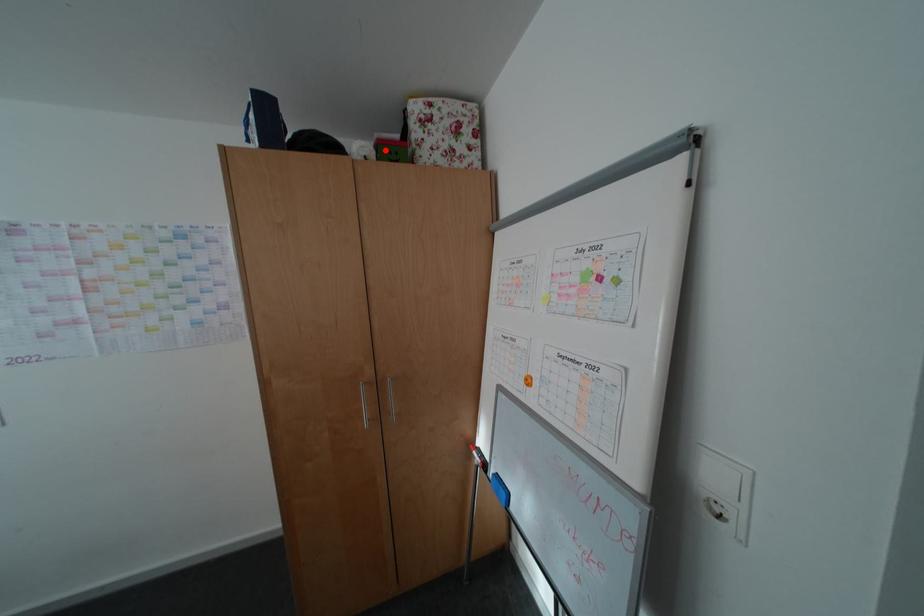
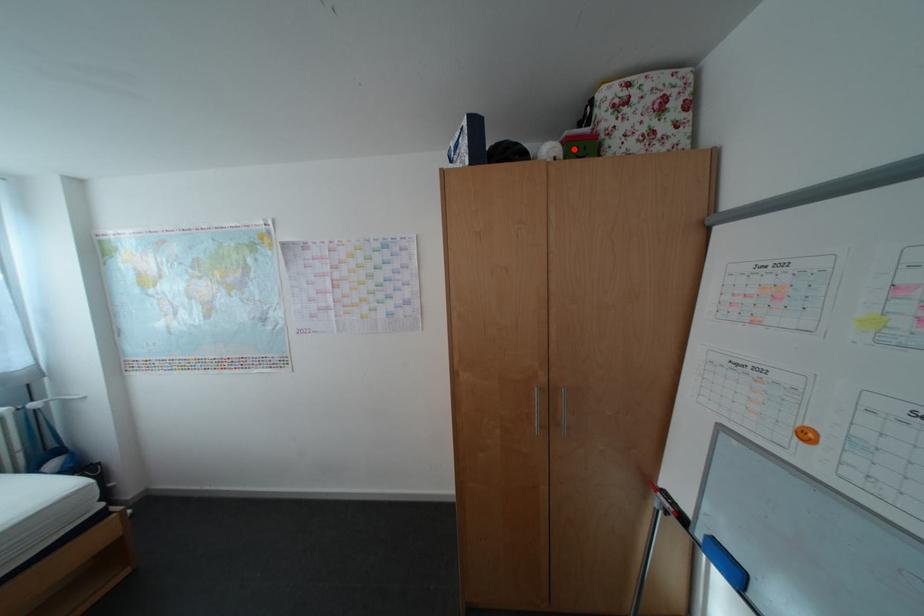
I am providing you with two images of the same scene from different viewpoints. A red point is marked on the first image and another point is marked on the second image. Are the points marked in image1 and image2 representing the same 3D position?

Yes